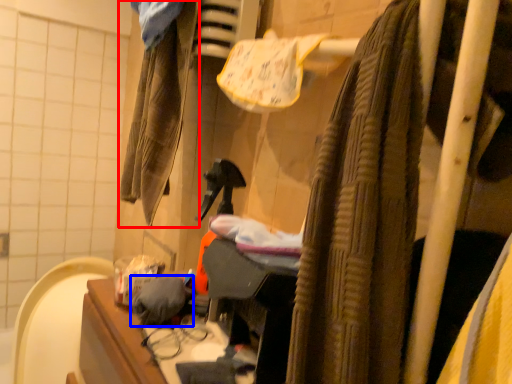
Question: Which object appears farthest to the camera in this image, clothing (highlighted by a red box) or clothing (highlighted by a blue box)?

Choices:
 (A) clothing
 (B) clothing

Answer: (A)